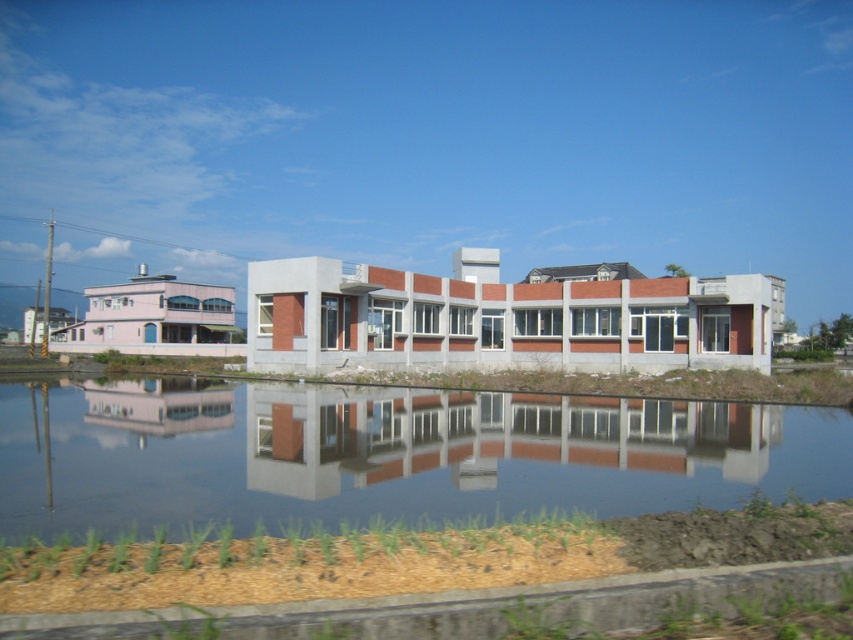
Measure the distance between smooth reflective water at center and smooth concrete building at center.

smooth reflective water at center is 38.31 inches from smooth concrete building at center.

Locate an element on the screen. smooth reflective water at center is located at coordinates (386, 454).